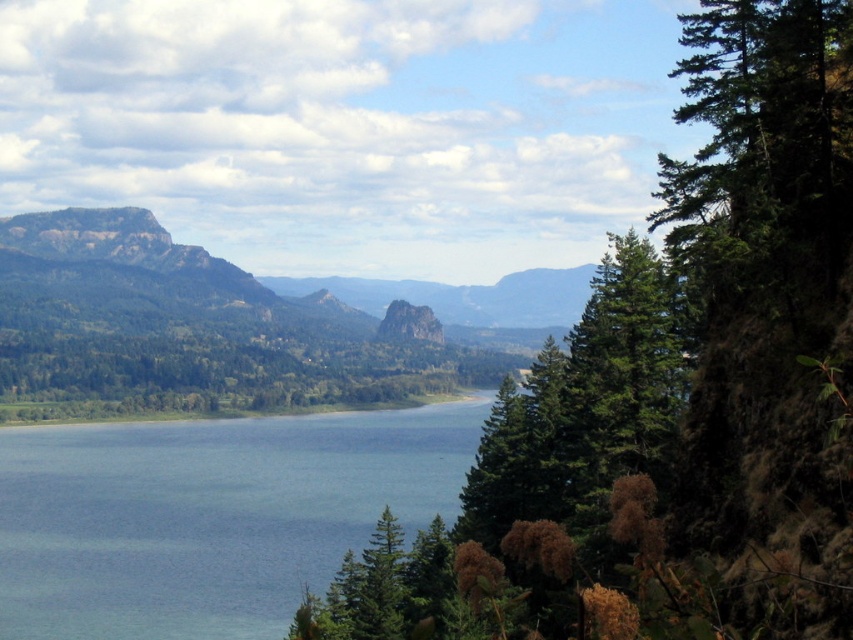
Which is more to the left, green textured tree at right or blue water at center?

blue water at center is more to the left.

Which of these two, green textured tree at right or blue water at center, stands taller?

Standing taller between the two is green textured tree at right.

Identify the location of green textured tree at right. This screenshot has height=640, width=853. (672, 392).